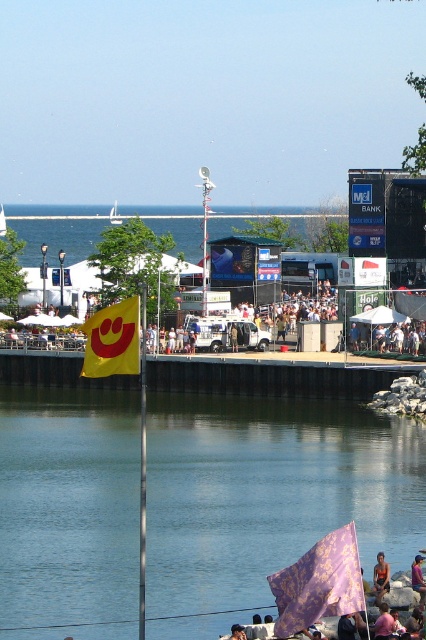
Is point (342, 544) closer to viewer compared to point (115, 346)?

Yes, point (342, 544) is closer to viewer.

I want to click on purple damask fabric at lower right, so click(319, 582).

Is transparent water at lower center to the left of orange fabric at lower right from the viewer's perspective?

Indeed, transparent water at lower center is positioned on the left side of orange fabric at lower right.

What do you see at coordinates (267, 497) in the screenshot? I see `transparent water at lower center` at bounding box center [267, 497].

Identify the location of transparent water at lower center. The image size is (426, 640). (267, 497).

Between point (97, 344) and point (386, 582), which one is positioned behind?

Positioned behind is point (386, 582).

Does yellow fabric flag at center-left have a larger size compared to orange fabric at lower right?

Correct, yellow fabric flag at center-left is larger in size than orange fabric at lower right.

Measure the distance between point (x=120, y=348) and camera.

Point (x=120, y=348) is 31.84 meters away from camera.

Where is `yellow fabric flag at center-left`? yellow fabric flag at center-left is located at coordinates (112, 340).